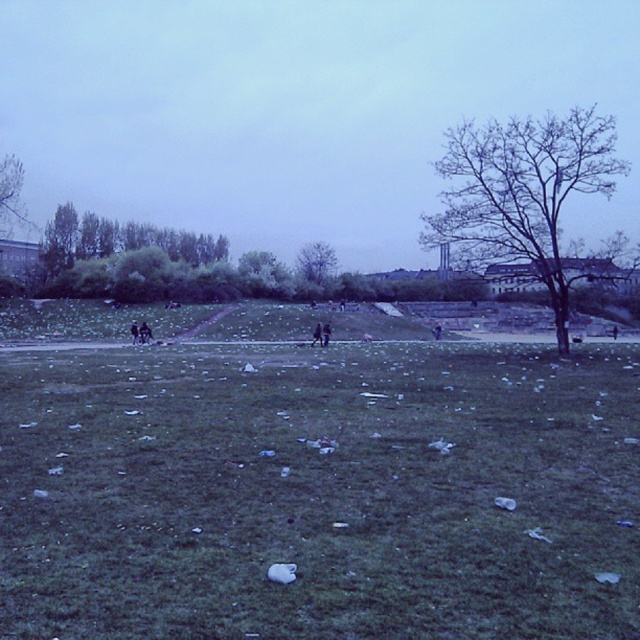
Question: In this image, where is bare branches at upper right located relative to green leafy tree at left?

Choices:
 (A) below
 (B) above

Answer: (A)

Question: Is green leafy tree at left positioned behind green leafy tree at center?

Choices:
 (A) yes
 (B) no

Answer: (A)

Question: Does green grass at center appear over bare branches at upper right?

Choices:
 (A) yes
 (B) no

Answer: (B)

Question: Which is nearer to the green leafy tree at center?

Choices:
 (A) green leafy tree at left
 (B) bare branches at upper right

Answer: (B)

Question: Which point is closer to the camera?

Choices:
 (A) green grass at center
 (B) green leafy tree at left
 (C) green leafy tree at center
 (D) bare branches at upper right

Answer: (A)

Question: Which of these objects is positioned closest to the bare branches at upper right?

Choices:
 (A) green grass at center
 (B) green leafy tree at left
 (C) green leafy tree at center

Answer: (C)